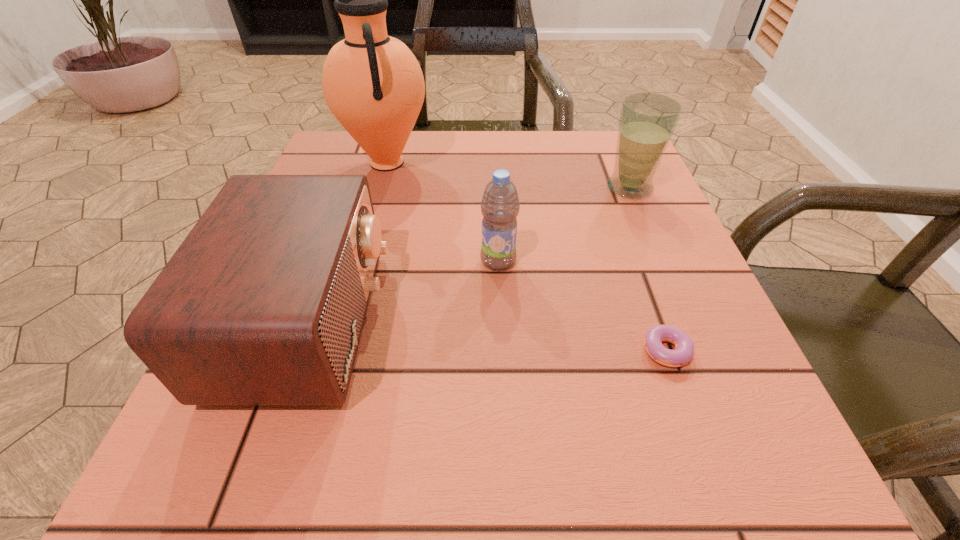
Find the location of a particular element. The width and height of the screenshot is (960, 540). vacant space at the right edge of the desktop is located at coordinates (684, 287).

Image resolution: width=960 pixels, height=540 pixels. Find the location of `free space at the near left corner of the desktop`. free space at the near left corner of the desktop is located at coordinates (192, 477).

Locate an element on the screen. free space that is in between the doughnut and the pitcher is located at coordinates (530, 257).

Locate an element on the screen. Image resolution: width=960 pixels, height=540 pixels. empty space between the water bottle and the glass is located at coordinates (564, 224).

The height and width of the screenshot is (540, 960). I want to click on free spot between the pitcher and the shortest object, so click(x=530, y=257).

The height and width of the screenshot is (540, 960). What are the coordinates of `unoccupied position between the doughnut and the third object from left to right` in the screenshot? It's located at (585, 306).

This screenshot has height=540, width=960. What are the coordinates of `empty location between the radio receiver and the doughnut` in the screenshot? It's located at (490, 336).

The height and width of the screenshot is (540, 960). What are the coordinates of `free space between the glass and the radio receiver` in the screenshot? It's located at (468, 254).

Locate an element on the screen. The image size is (960, 540). free space between the tallest object and the shortest object is located at coordinates (530, 257).

Locate an element on the screen. The height and width of the screenshot is (540, 960). empty location between the radio receiver and the third object from right to left is located at coordinates (403, 291).